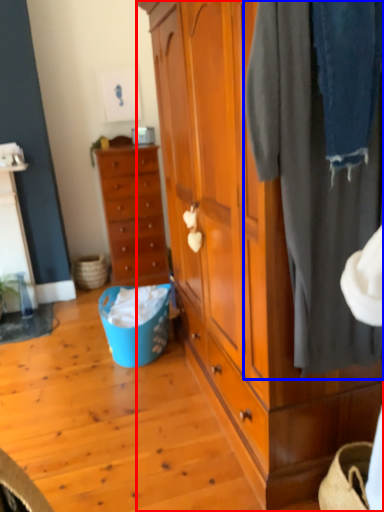
Question: Which of the following is the farthest to the observer, cabinetry (highlighted by a red box) or clothing (highlighted by a blue box)?

Choices:
 (A) cabinetry
 (B) clothing

Answer: (B)